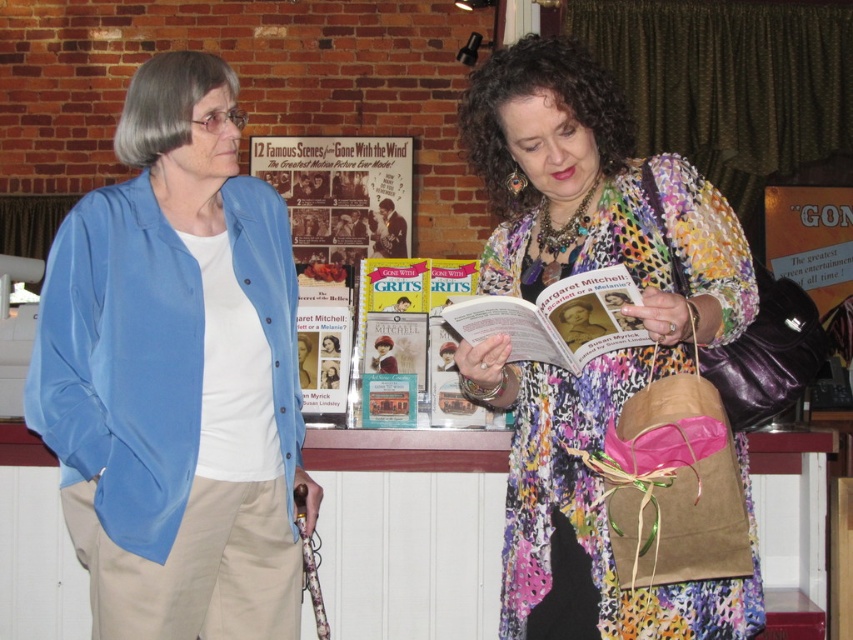
You are organizing a small book signing event and need to place both the matte paper magazine at center and the matte paper book at center on a shelf. Since space is limited, which item should you place first to ensure both fit?

The matte paper book at center should be placed first because it is smaller in size compared to the matte paper magazine at center, allowing more space for the larger magazine afterward.

You are an event planner trying to hang a new banner that must be placed exactly at coordinates 0.303, 0.400 in the room. The matte paper poster at center is already occupying that spot. Can you hang the banner there without removing the existing poster?

The matte paper poster at center is already positioned at point (x=340, y=193), so you cannot hang the banner there without removing the existing poster.

You are organizing a book signing event and need to display promotional materials. You have a matte paper poster at center and a matte paper magazine at center. Which one should you place higher up on the wall to ensure visibility?

The matte paper poster at center is bigger than the matte paper magazine at center, so placing the matte paper poster at center higher up on the wall will ensure better visibility due to its larger size.